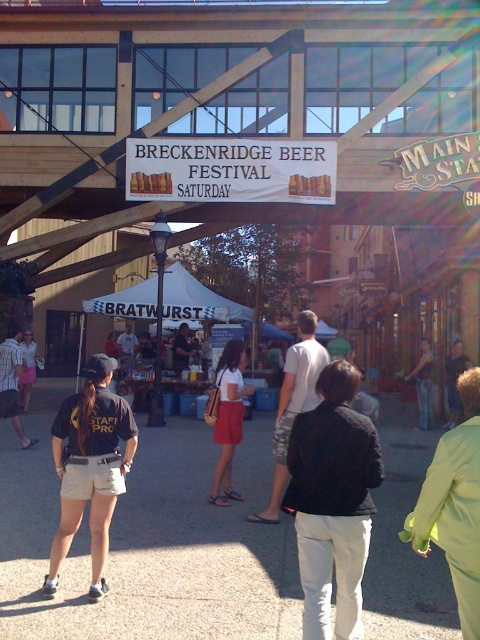
Question: Can you confirm if matte white shirt at center is positioned above denim pants at center?

Choices:
 (A) yes
 (B) no

Answer: (A)

Question: Which of these objects is positioned closest to the black shirt at left?

Choices:
 (A) white fabric canopy at center
 (B) camouflage shorts at center
 (C) dark gray uniform at lower left
 (D) denim pants at center

Answer: (A)

Question: Considering the real-world distances, which object is farthest from the matte white shirt at center?

Choices:
 (A) camouflage shorts at center
 (B) white fabric canopy at center
 (C) black cotton t-shirt at left

Answer: (B)

Question: Does black matte jacket at lower center appear under black shirt at left?

Choices:
 (A) no
 (B) yes

Answer: (A)

Question: Can you confirm if black cotton t-shirt at left is wider than black shirt at left?

Choices:
 (A) no
 (B) yes

Answer: (B)

Question: Based on their relative distances, which object is nearer to the bright green coat at lower right?

Choices:
 (A) matte white shirt at center
 (B) dark gray uniform at lower left
 (C) black matte jacket at lower center

Answer: (C)